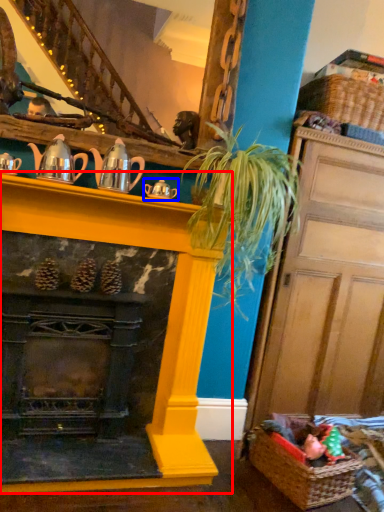
Question: Which object is closer to the camera taking this photo, fireplace (highlighted by a red box) or tea pot (highlighted by a blue box)?

Choices:
 (A) fireplace
 (B) tea pot

Answer: (A)